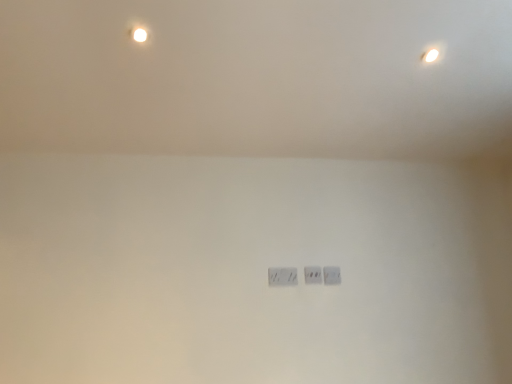
Question: From a real-world perspective, does white plastic power plugs and sockets at center, which is the second power plugs and sockets in left-to-right order, sit lower than white plastic power plugs and sockets at center, which is counted as the first power plugs and sockets, starting from the left?

Choices:
 (A) yes
 (B) no

Answer: (B)

Question: Is the position of white plastic power plugs and sockets at center, which is the second power plugs and sockets in left-to-right order, less distant than that of white plastic power plugs and sockets at center, which is counted as the first power plugs and sockets, starting from the left?

Choices:
 (A) yes
 (B) no

Answer: (B)

Question: From the image's perspective, is white plastic power plugs and sockets at center, which ranks as the 2th power plugs and sockets in right-to-left order, on top of white plastic power plugs and sockets at center, which is counted as the first power plugs and sockets, starting from the left?

Choices:
 (A) no
 (B) yes

Answer: (B)

Question: Is white plastic power plugs and sockets at center, which is the second power plugs and sockets in left-to-right order, oriented towards white plastic power plugs and sockets at center, marked as the 3th power plugs and sockets in a right-to-left arrangement?

Choices:
 (A) yes
 (B) no

Answer: (B)

Question: Is white plastic power plugs and sockets at center, which is the second power plugs and sockets in left-to-right order, taller than white plastic power plugs and sockets at center, which is counted as the first power plugs and sockets, starting from the left?

Choices:
 (A) yes
 (B) no

Answer: (B)

Question: In terms of width, does white plastic power plugs and sockets at center, which is the second power plugs and sockets in left-to-right order, look wider or thinner when compared to white plastic power plugs and sockets at center, marked as the 3th power plugs and sockets in a right-to-left arrangement?

Choices:
 (A) thin
 (B) wide

Answer: (A)

Question: Is point (310, 279) positioned closer to the camera than point (292, 279)?

Choices:
 (A) farther
 (B) closer

Answer: (A)

Question: From a real-world perspective, is white plastic power plugs and sockets at center, which is the second power plugs and sockets in left-to-right order, positioned above or below white plastic power plugs and sockets at center, marked as the 3th power plugs and sockets in a right-to-left arrangement?

Choices:
 (A) above
 (B) below

Answer: (A)

Question: Is white plastic power plugs and sockets at center, which ranks as the 2th power plugs and sockets in right-to-left order, inside the boundaries of white plastic power plugs and sockets at center, which is counted as the first power plugs and sockets, starting from the left, or outside?

Choices:
 (A) outside
 (B) inside

Answer: (A)

Question: Based on their positions, is white plastic power plugs and sockets at center, which is counted as the first power plugs and sockets, starting from the left, located to the left or right of white plastic power plugs and sockets at center, which is the second power plugs and sockets in left-to-right order?

Choices:
 (A) right
 (B) left

Answer: (B)

Question: From the image's perspective, is white plastic power plugs and sockets at center, which is counted as the first power plugs and sockets, starting from the left, located above or below white plastic power plugs and sockets at center, which ranks as the 2th power plugs and sockets in right-to-left order?

Choices:
 (A) above
 (B) below

Answer: (B)

Question: Considering the positions of point 283,279 and point 316,278, is point 283,279 closer or farther from the camera than point 316,278?

Choices:
 (A) farther
 (B) closer

Answer: (B)

Question: In terms of size, does white plastic power plugs and sockets at center, which is counted as the first power plugs and sockets, starting from the left, appear bigger or smaller than white plastic power plugs and sockets at center, which is the second power plugs and sockets in left-to-right order?

Choices:
 (A) small
 (B) big

Answer: (B)

Question: From a real-world perspective, is white plastic power plugs and sockets at center, marked as the 3th power plugs and sockets in a right-to-left arrangement, physically located above or below white plastic power plugs and sockets at center, the first power plugs and sockets positioned from the right?

Choices:
 (A) below
 (B) above

Answer: (A)

Question: Is point (269, 269) closer or farther from the camera than point (330, 274)?

Choices:
 (A) farther
 (B) closer

Answer: (B)